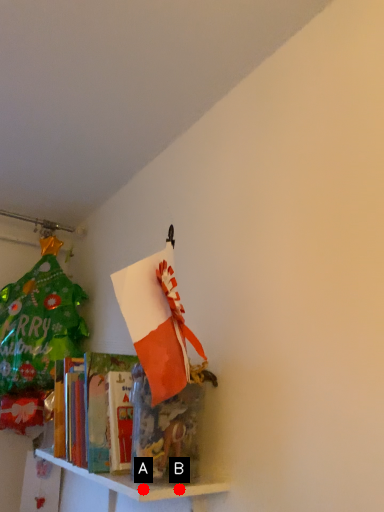
Question: Two points are circled on the image, labeled by A and B beside each circle. Which point is closer to the camera taking this photo?

Choices:
 (A) A is closer
 (B) B is closer

Answer: (A)